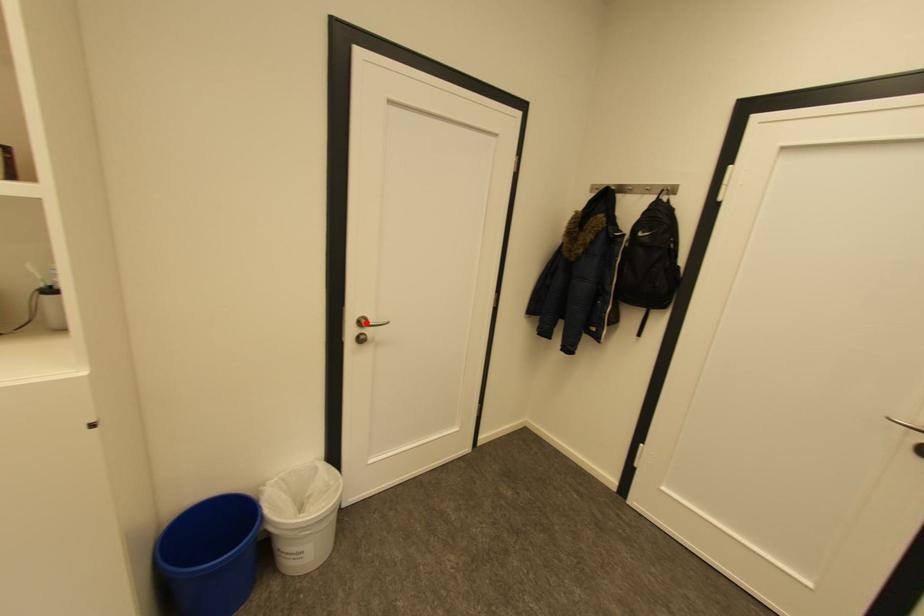
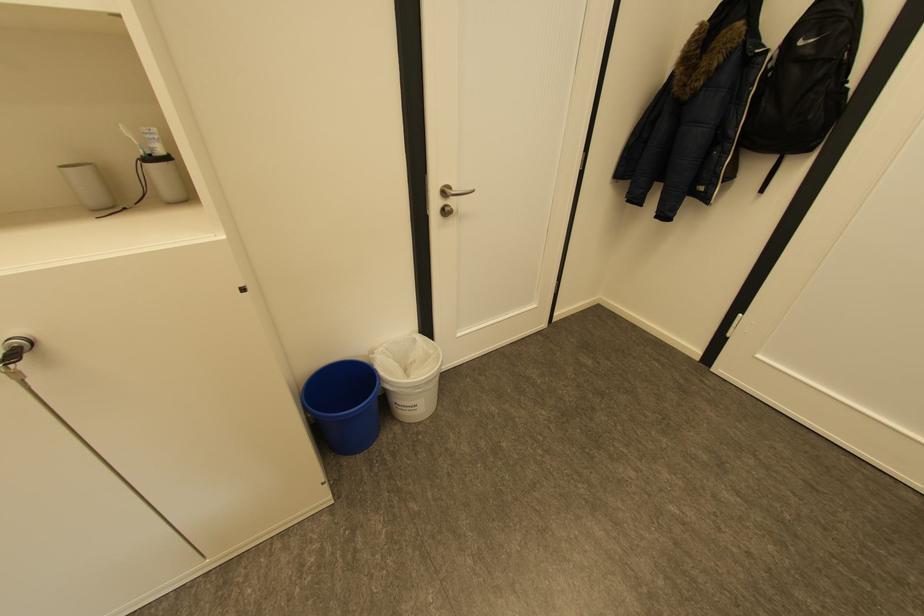
Locate, in the second image, the point that corresponds to the highlighted location in the first image.

(451, 192)